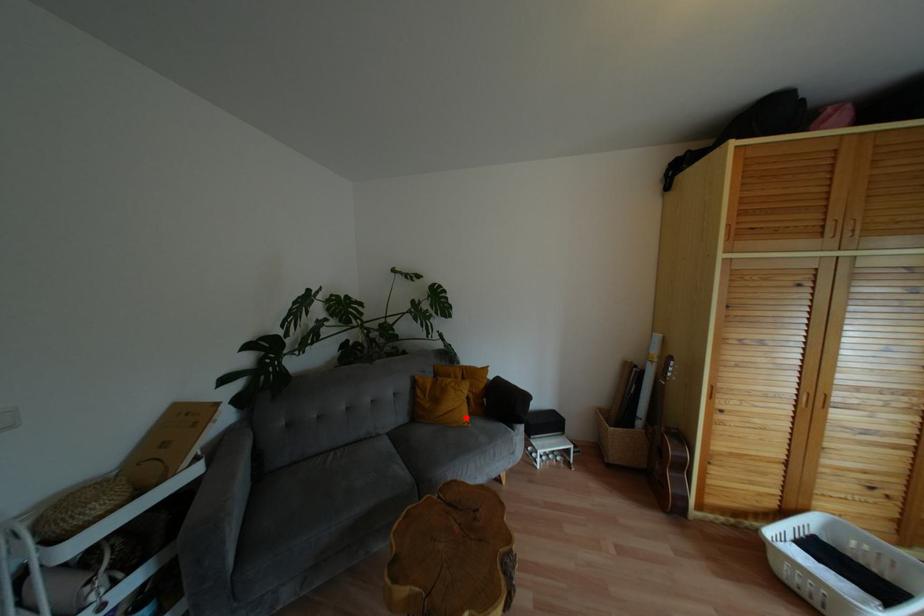
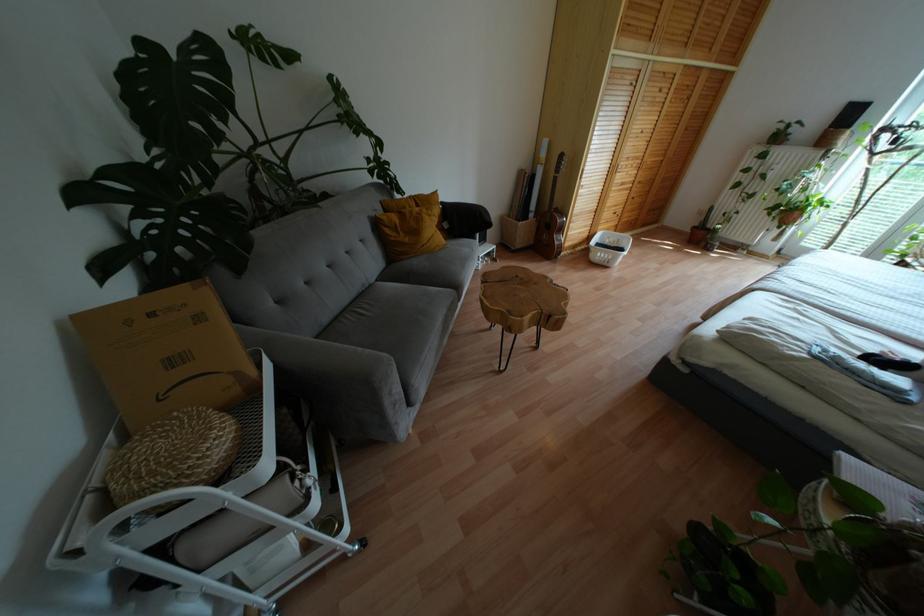
Question: I am providing you with two images of the same scene from different viewpoints. Image1 has a red point marked. In image2, the corresponding 3D location appears at what relative position? Reply with the corresponding letter.

Choices:
 (A) Closer
 (B) Farther

Answer: (A)